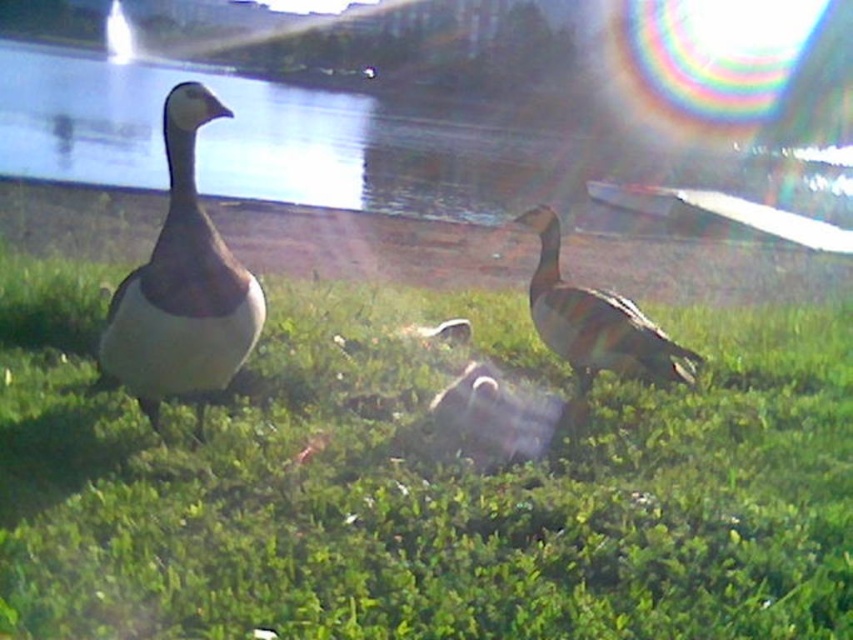
You are a photographer planning to capture a landscape shot of the scene. You need to ensure that the transparent glass water at center and the white matte duck at left are both in the frame. Based on their widths, which object should you adjust your camera angle to prioritize to include both in the composition?

The transparent glass water at center is wider than the white matte duck at left. To include both in the composition, prioritize framing the wider transparent glass water at center first, then adjust to include the narrower white matte duck at left.

You are a photographer trying to capture both the green grassy at center and the brown striped duck at center in a single shot. Considering their sizes, which object will occupy more space in your photo?

The green grassy at center has a larger size compared to the brown striped duck at center, so it will occupy more space in the photo.

You are a birdwatcher trying to capture both the transparent glass water at center and the brown striped duck at center in a single photo. Given that your camera has a 50mm lens, which has a field of view of approximately 46 degrees, can you estimate whether both objects will fit in the frame from your current position? Please consider the distance between them and the lens specifications.

The transparent glass water at center and brown striped duck at center are 17.87 meters apart. With a 50mm lens providing a 46 degree field of view, the maximum distance covered in the frame can be calculated using trigonometry. The tangent of half the angle gives the ratio of half the width to the distance. Assuming the camera is positioned at a reasonable distance where the 17.87 meters between the objects falls within the 46 degree field of view, it is likely possible to capture both in a single photo.